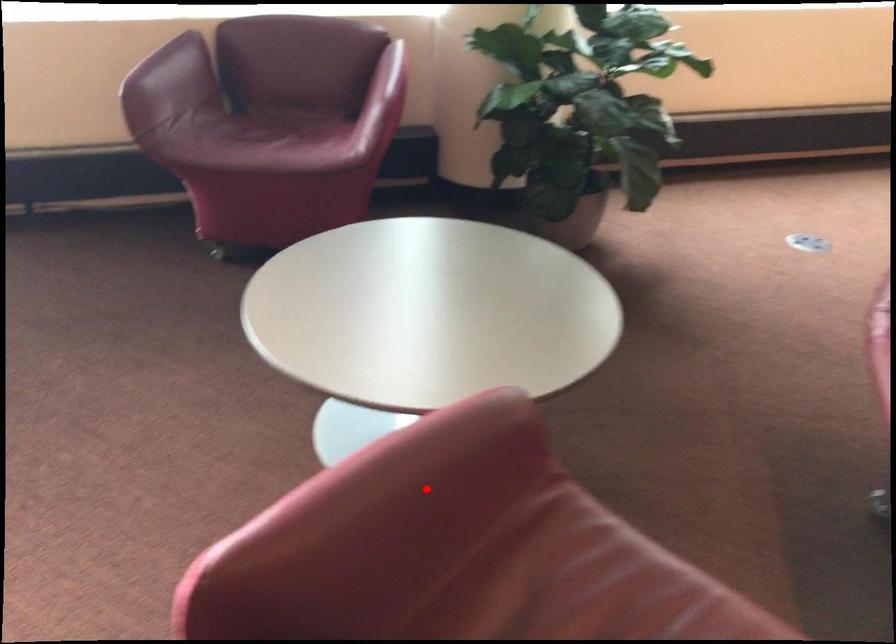
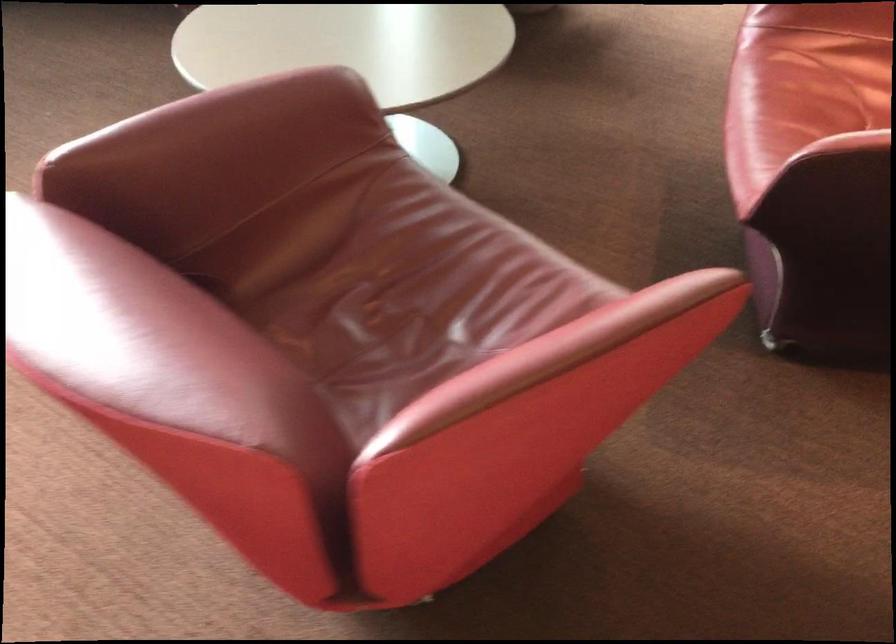
The point at the highlighted location is marked in the first image. Where is the corresponding point in the second image?

(255, 118)